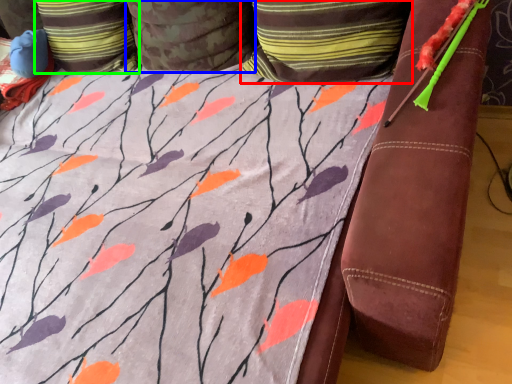
Question: Which object is the closest to the pillow (highlighted by a red box)? Choose among these: pillow (highlighted by a blue box) or pillow (highlighted by a green box).

Choices:
 (A) pillow
 (B) pillow

Answer: (A)